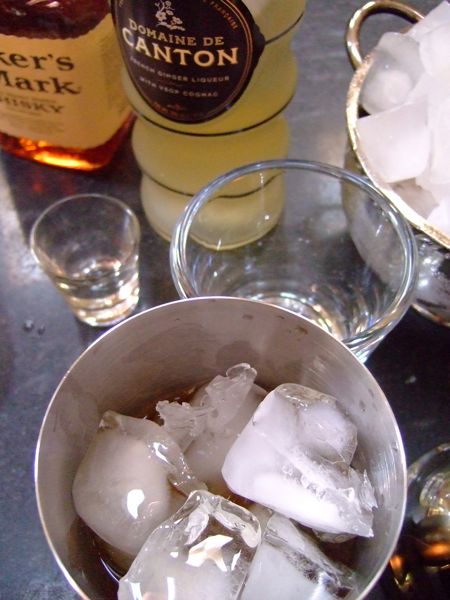
Locate an element on the screen. This screenshot has width=450, height=600. shot glass is located at coordinates (83, 258).